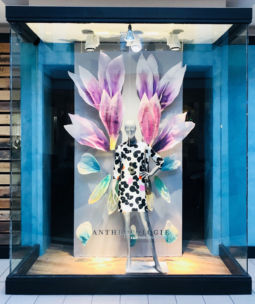
Image resolution: width=255 pixels, height=304 pixels. Identify the location of mannequin legs. (125, 226), (146, 224).